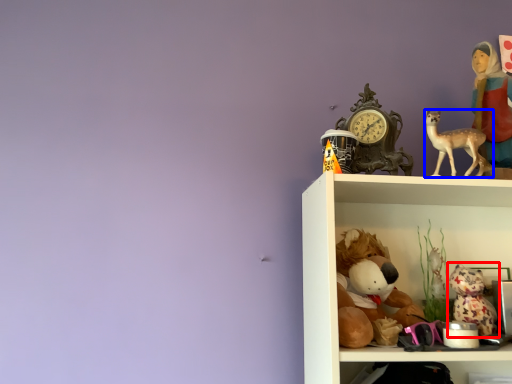
Question: Among these objects, which one is nearest to the camera, toy (highlighted by a red box) or deer (highlighted by a blue box)?

Choices:
 (A) toy
 (B) deer

Answer: (B)